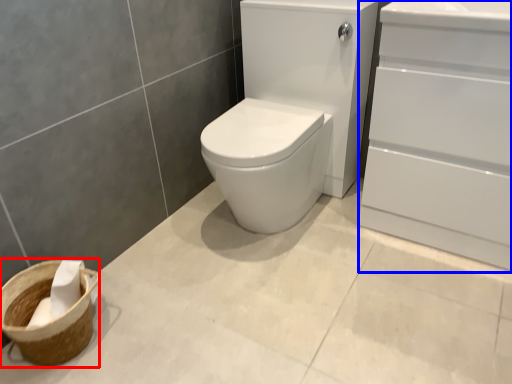
Question: Which object is further to the camera taking this photo, basket container (highlighted by a red box) or screen door (highlighted by a blue box)?

Choices:
 (A) basket container
 (B) screen door

Answer: (A)